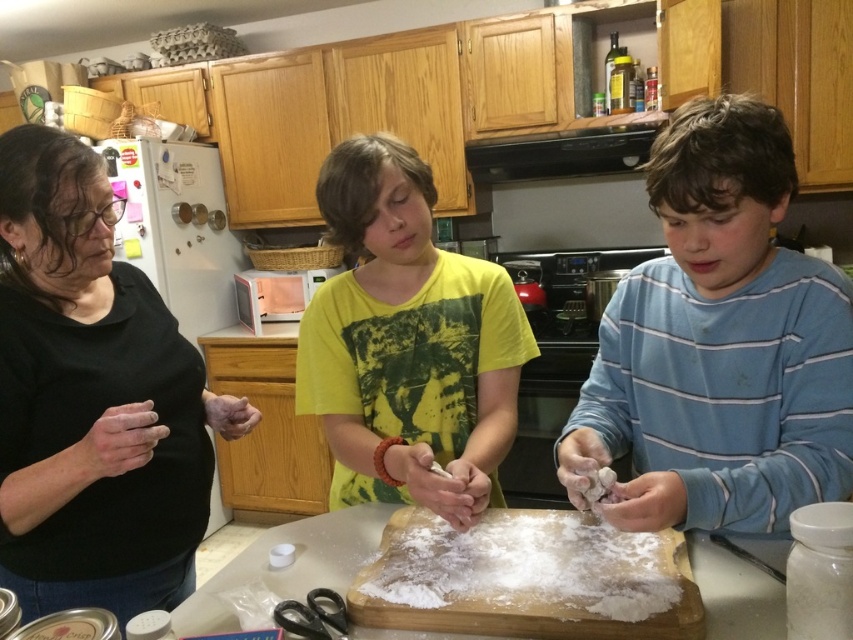
You are a chef observing the kitchen scene. You need to decide which item is narrower between the black matte shirt at left and the white powdery flour at center. Which one is it?

The black matte shirt at left is thinner than the white powdery flour at center, so the black matte shirt at left is narrower.

You are standing in the kitchen and see the black matte shirt at left and the white powdery flour at center. Which object is positioned more to the left?

The black matte shirt at left is positioned more to the left than the white powdery flour at center.

You are standing in the kitchen and notice two shirts in the scene. Which one is taller, the black matte shirt at left or the yellow cotton shirt at center?

The black matte shirt at left is taller than the yellow cotton shirt at center.